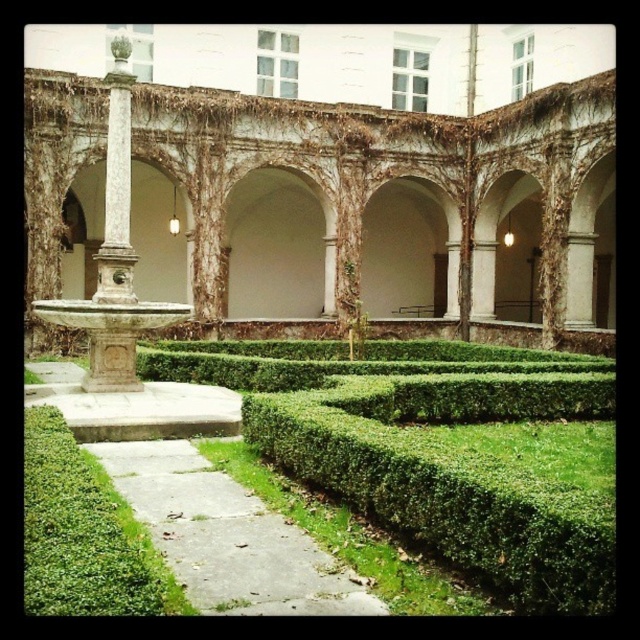
You are standing in the courtyard and want to take a photo of the white stone fountain at center and the white stone archway at center. Which one appears higher in the photo?

The white stone fountain at center appears higher in the photo because it is positioned above the white stone archway at center.

You are standing in the courtyard and want to take a photo that includes both the point at coordinates point (250,259) and point (115,45). Which point will appear closer to the edges of your camera frame?

Point (115,45) will appear closer to the edges of your camera frame because it is closer to the camera than point (250,259), which is further away.